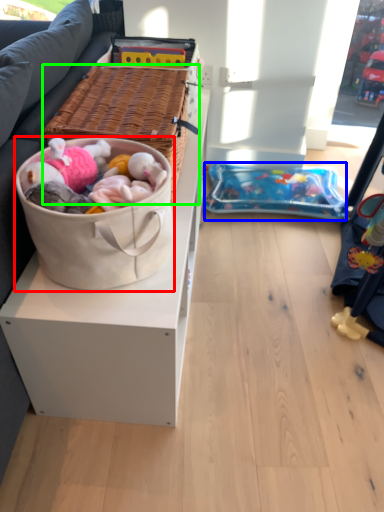
Question: Based on their relative distances, which object is nearer to gift basket (highlighted by a red box)? Choose from infant bed (highlighted by a blue box) and picnic basket (highlighted by a green box).

Choices:
 (A) infant bed
 (B) picnic basket

Answer: (B)